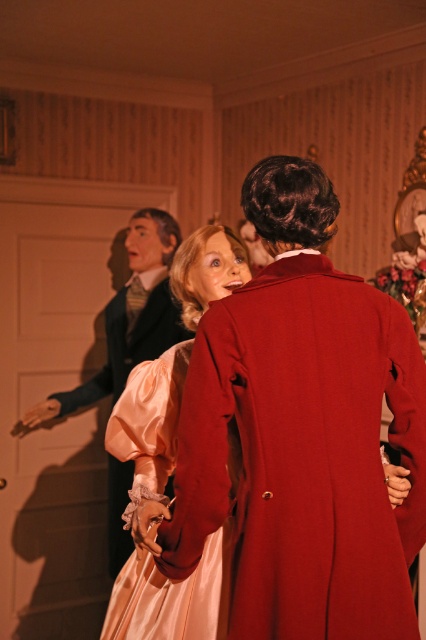
In the scene shown: You are a stagehand who needs to place a 6.5 feet long ladder between the silky pink dress at center and the matte black coat at left. Will the ladder fit between them without overlapping either?

The distance between the silky pink dress at center and the matte black coat at left is 7.35 feet. Since the ladder is 6.5 feet long, it will fit between them with some space to spare.

You are an assistant helping to organize a costume exhibition. You have two dresses displayed in the center of the room, a silky pink dress at center and a silky peach dress at center. Which dress should be placed on the higher shelf to ensure proper visibility?

The silky pink dress at center is much taller than the silky peach dress at center, so placing it on the higher shelf will ensure proper visibility.